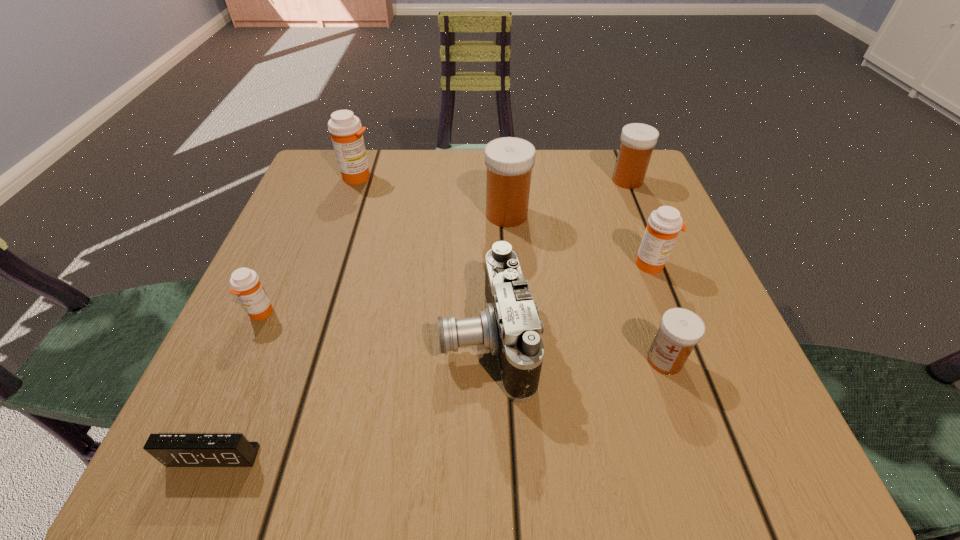
The height and width of the screenshot is (540, 960). Identify the location of the fifth medicine from right to left. point(346,130).

Locate an element on the screen. Image resolution: width=960 pixels, height=540 pixels. the second orange medicine from right to left is located at coordinates 346,130.

Where is `the leftmost white medicine`? The height and width of the screenshot is (540, 960). the leftmost white medicine is located at coordinates (509, 160).

Find the location of `the second nearest white medicine`. the second nearest white medicine is located at coordinates (509, 160).

You are a GUI agent. You are given a task and a screenshot of the screen. Output one action in this format:
    pyautogui.click(x=<x>, y=<y>)
    Task: Click on the farthest white medicine
    
    Given the screenshot: What is the action you would take?
    pyautogui.click(x=637, y=140)

Find the location of a particular element. The width and height of the screenshot is (960, 540). the second smallest orange medicine is located at coordinates (663, 226).

This screenshot has width=960, height=540. Find the location of `the second farthest orange medicine`. the second farthest orange medicine is located at coordinates (663, 226).

Find the location of a particular element. camera is located at coordinates (509, 327).

You are a GUI agent. You are given a task and a screenshot of the screen. Output one action in this format:
    pyautogui.click(x=<x>, y=<y>)
    Task: Click on the smallest orange medicine
    This screenshot has height=540, width=960.
    Given the screenshot: What is the action you would take?
    pyautogui.click(x=245, y=283)

At what (x,y) coordinates should I click in order to perform the action: click on the nearest orange medicine. Please return your answer as a coordinate pair (x, y). The height and width of the screenshot is (540, 960). Looking at the image, I should click on (245, 283).